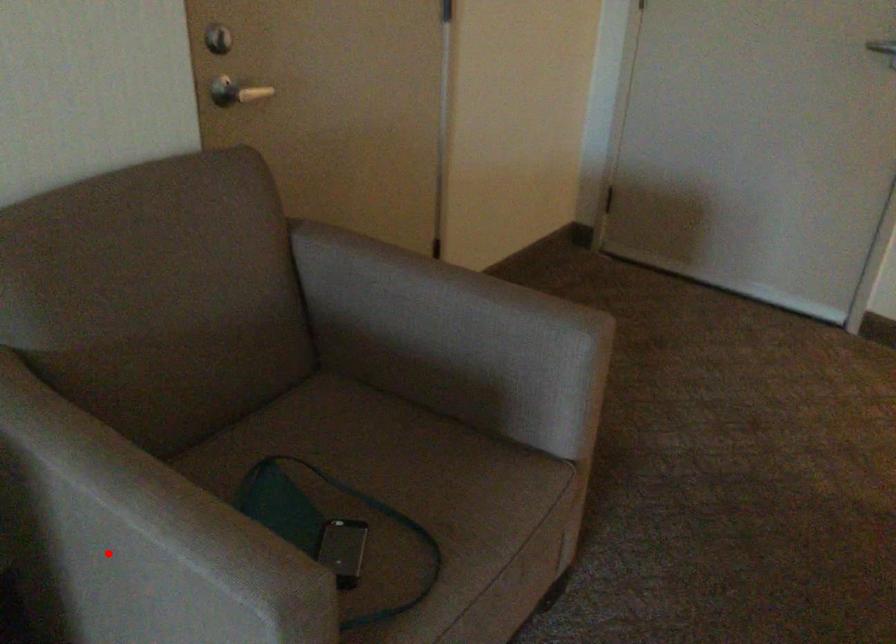
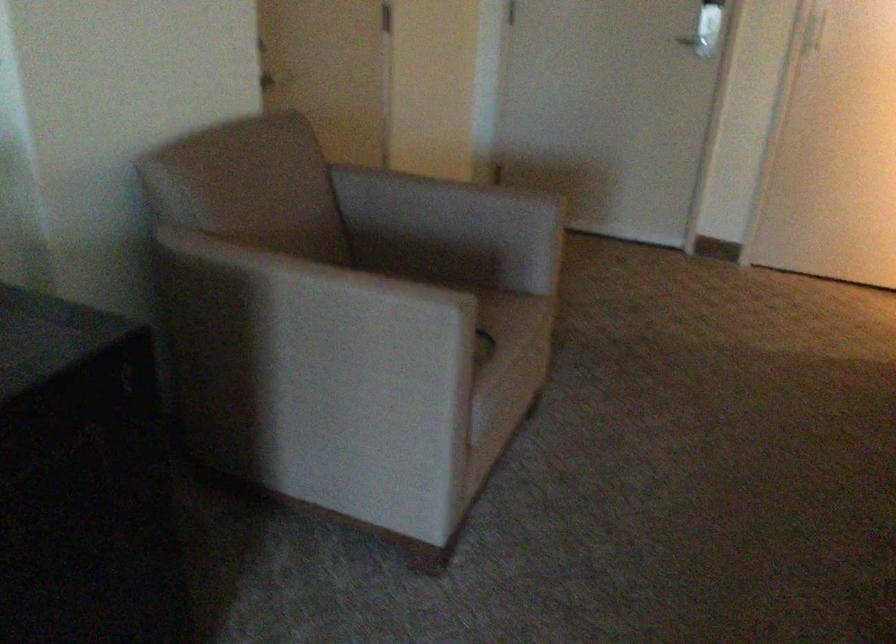
Question: I am providing you with two images of the same scene from different viewpoints. A red point is shown in image1. For the corresponding object point in image2, is it positioned nearer or farther from the camera?

Choices:
 (A) Nearer
 (B) Farther

Answer: (B)